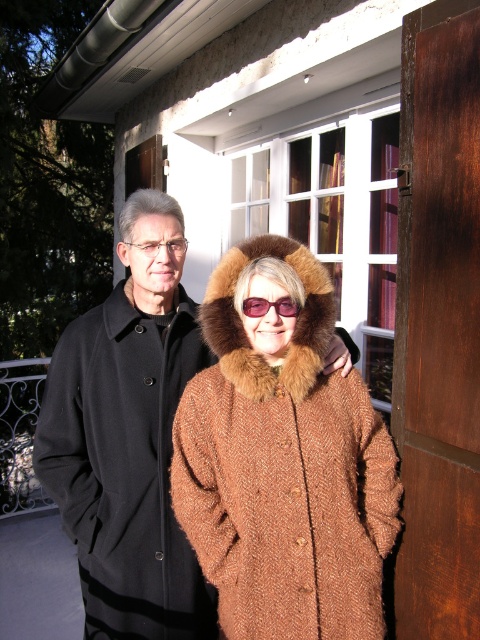
Question: Which point appears farthest from the camera in this image?

Choices:
 (A) (278, 308)
 (B) (72, 522)
 (C) (156, 243)

Answer: (C)

Question: Observing the image, what is the correct spatial positioning of black wool coat at left in reference to matte black glasses at upper left?

Choices:
 (A) below
 (B) above

Answer: (A)

Question: Which object appears farthest from the camera in this image?

Choices:
 (A) matte black glasses at upper left
 (B) black wool coat at left
 (C) pink plastic goggles at center
 (D) brown woolen coat at center

Answer: (A)

Question: Estimate the real-world distances between objects in this image. Which object is farther from the pink plastic goggles at center?

Choices:
 (A) brown woolen coat at center
 (B) matte black glasses at upper left

Answer: (B)

Question: Is pink plastic goggles at center further to the viewer compared to matte black glasses at upper left?

Choices:
 (A) yes
 (B) no

Answer: (B)

Question: Is brown woolen coat at center bigger than matte black glasses at upper left?

Choices:
 (A) no
 (B) yes

Answer: (B)